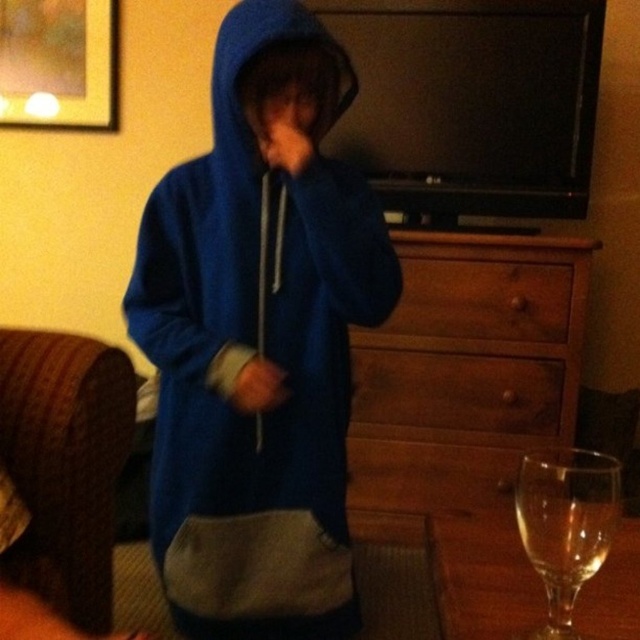
You are a delivery person who needs to place a large package on the surface between the blue fleece hoodie at center and the brown wood drawer at center. Can you fit the package there?

The blue fleece hoodie at center is larger in size than the brown wood drawer at center, so the space between them may be too narrow to fit a large package.

You are an interior designer assessing the living room layout. You need to determine if the brushed metal picture frame at upper left and the brown wood drawer at center can be placed side by side without overlapping. Based on their heights, is this possible?

The brushed metal picture frame at upper left is taller than the brown wood drawer at center. Since they can be placed side by side horizontally, their heights do not affect their ability to be placed next to each other without overlapping. However, the total width required would depend on their individual widths, which are not provided.

Based on the scene description, where is the brushed metal picture frame at upper left located in terms of coordinates?

The brushed metal picture frame at upper left is located at coordinates point (58, 61).